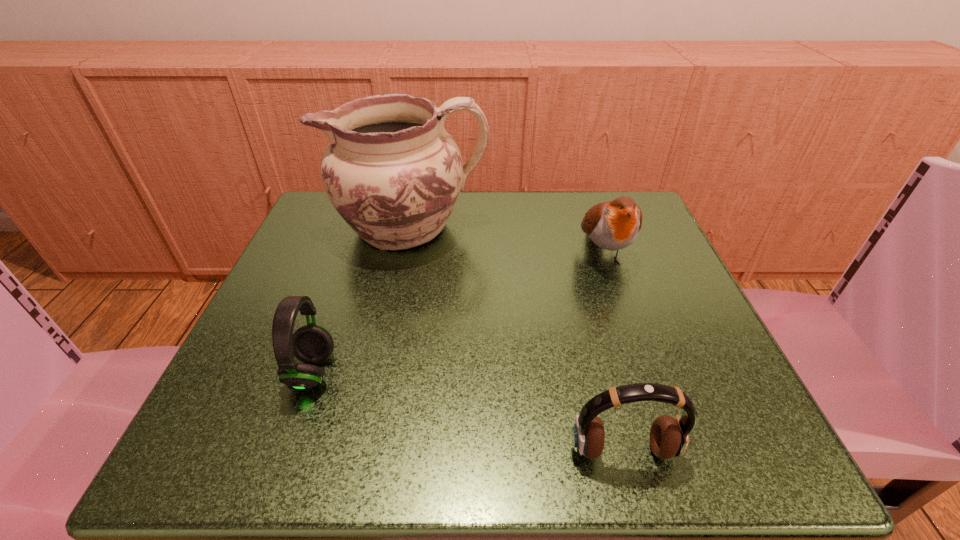
The height and width of the screenshot is (540, 960). Identify the location of free space at the left edge. (329, 308).

The image size is (960, 540). In the image, there is a desktop. In order to click on vacant space at the right edge in this screenshot , I will do `click(613, 262)`.

In the image, there is a desktop. Where is `vacant space at the far left corner`? The width and height of the screenshot is (960, 540). vacant space at the far left corner is located at coordinates (312, 209).

I want to click on vacant space at the near left corner of the desktop, so tap(284, 448).

The height and width of the screenshot is (540, 960). I want to click on vacant space at the far right corner, so click(x=615, y=251).

Identify the location of vacant area that lies between the pitcher and the bird. The height and width of the screenshot is (540, 960). (507, 241).

The image size is (960, 540). Find the location of `free spot between the nearest object and the pitcher`. free spot between the nearest object and the pitcher is located at coordinates click(516, 339).

Locate an element on the screen. free space between the pitcher and the left headset is located at coordinates (361, 300).

Identify the location of empty space that is in between the bird and the second nearest object. (458, 313).

Image resolution: width=960 pixels, height=540 pixels. Find the location of `vacant space in between the nearest object and the pitcher`. vacant space in between the nearest object and the pitcher is located at coordinates (516, 339).